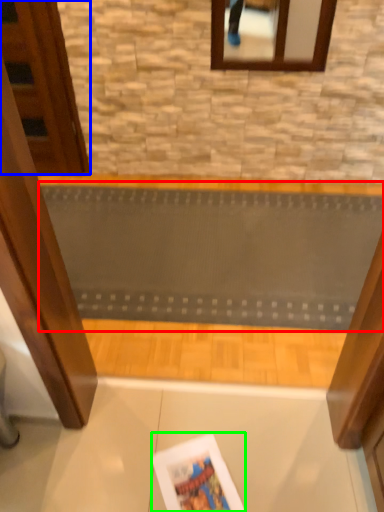
Question: Considering the real-world distances, which object is farthest from ramp (highlighted by a red box)? door (highlighted by a blue box) or magazine (highlighted by a green box)?

Choices:
 (A) door
 (B) magazine

Answer: (B)